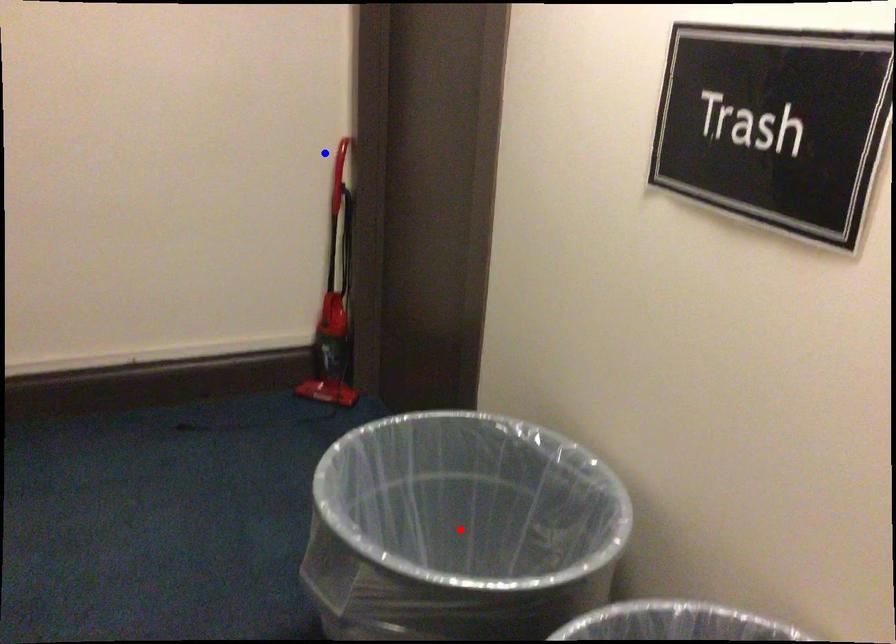
Question: In the image, two points are highlighted. Which point is nearer to the camera? Reply with the corresponding letter.

Choices:
 (A) blue point
 (B) red point

Answer: (B)